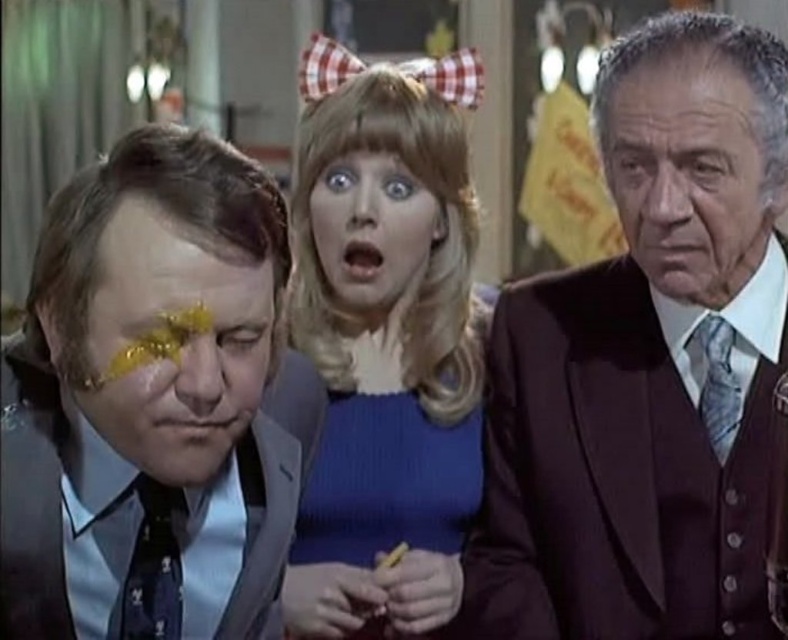
Between matte gray suit at left and shiny gold face at left, which one is positioned higher?

shiny gold face at left is above.

Is matte gray suit at left to the right of shiny gold face at left from the viewer's perspective?

In fact, matte gray suit at left is to the left of shiny gold face at left.

Is point (266, 348) positioned in front of point (225, 371)?

That is False.

Where is `matte gray suit at left`? matte gray suit at left is located at coordinates (149, 403).

Is blue ribbed sweater at center positioned behind smooth blonde hair at center?

No, it is in front of smooth blonde hair at center.

Which is above, blue ribbed sweater at center or smooth blonde hair at center?

smooth blonde hair at center

Does point (359, 154) lie behind point (355, 252)?

No, (359, 154) is closer to viewer.

Where is `blue ribbed sweater at center`? This screenshot has width=788, height=640. blue ribbed sweater at center is located at coordinates (385, 321).

Looking at this image, is blue ribbed sweater at center shorter than shiny gold face at left?

In fact, blue ribbed sweater at center may be taller than shiny gold face at left.

Find the location of `blue ribbed sweater at center`. blue ribbed sweater at center is located at coordinates (385, 321).